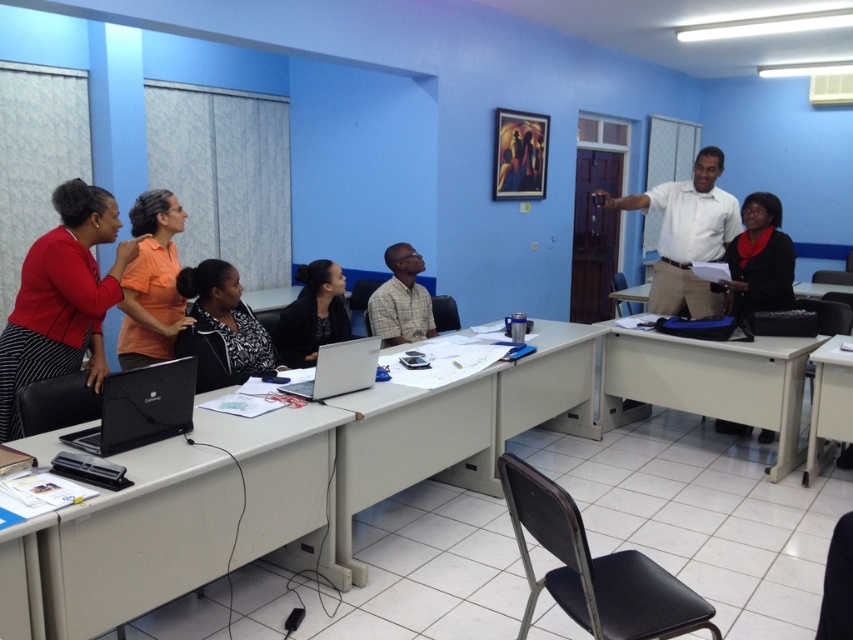
You are a person who needs to move a matte black laptop at left to the black matte jacket at right. Can you carry it directly without needing to go around any obstacles?

The distance between the matte black laptop at left and the black matte jacket at right is 3.62 meters. Since there are no obstacles mentioned in the scene description, you can carry it directly.

You are a student entering the classroom and need to retrieve your laptop and jacket. The laptop is the black matte laptop at lower left and the jacket is the black matte jacket at center. Which item should you pick up first if you want to grab both items without moving past the other?

You should pick up the black matte laptop at lower left first because it is located below the black matte jacket at center, so you can reach it without moving past the jacket first.

You are a student in the classroom and need to retrieve your matte black laptop at left and black matte jacket at right. Which item is closer to the floor?

The matte black laptop at left is closer to the floor since it is located below the black matte jacket at right.